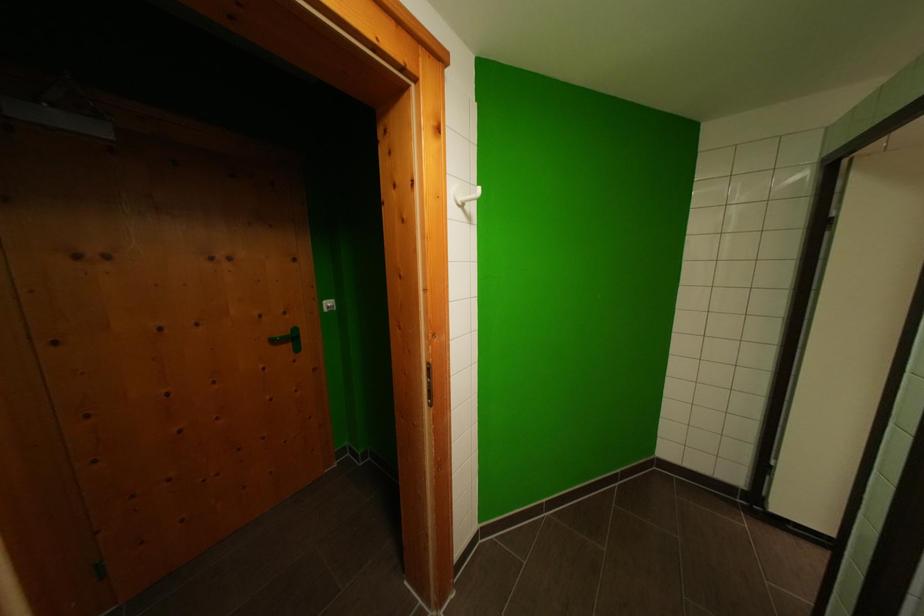
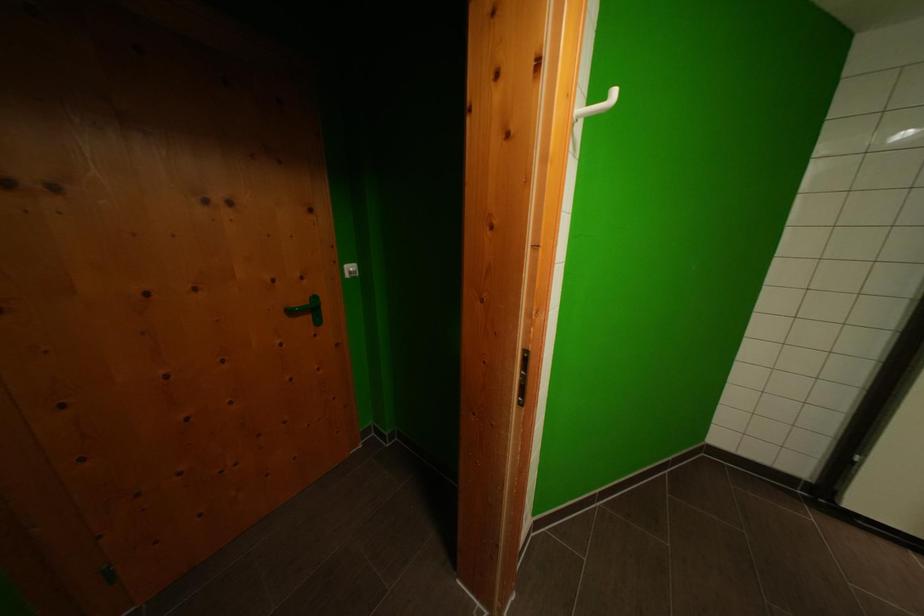
In the second image, find the point that corresponds to point (335, 307) in the first image.

(358, 272)